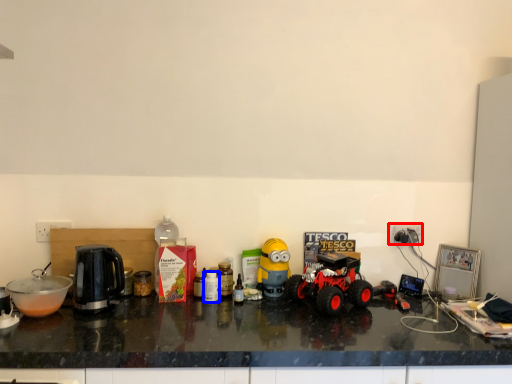
Question: Which object is closer to the camera taking this photo, power outlet (highlighted by a red box) or bottle (highlighted by a blue box)?

Choices:
 (A) power outlet
 (B) bottle

Answer: (B)